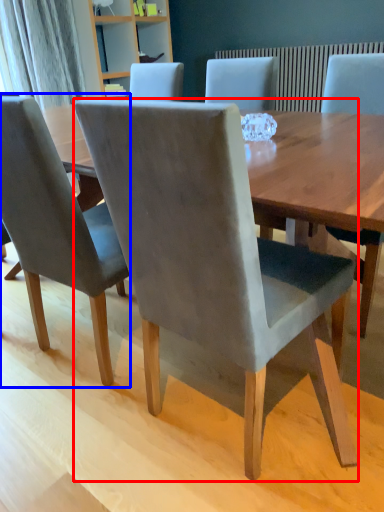
Question: Among these objects, which one is nearest to the camera, chair (highlighted by a red box) or chair (highlighted by a blue box)?

Choices:
 (A) chair
 (B) chair

Answer: (A)